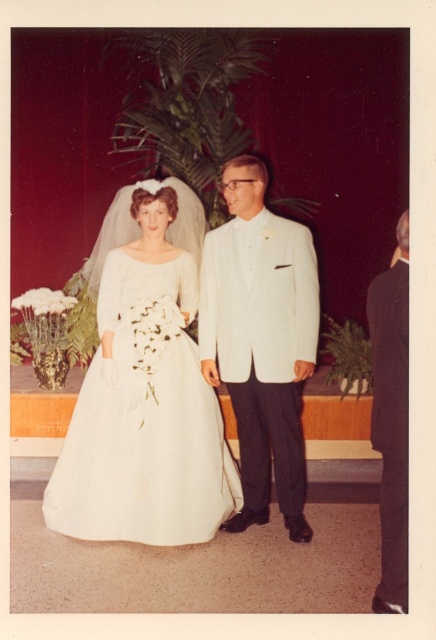
Is white satin dress at center shorter than black satin suit at right?

Incorrect, white satin dress at center's height does not fall short of black satin suit at right's.

Is point (139, 188) more distant than point (381, 348)?

Yes, it is behind point (381, 348).

Does point (205, 419) lie in front of point (391, 342)?

No, (205, 419) is behind (391, 342).

What are the coordinates of `white satin dress at center` in the screenshot? It's located at (146, 394).

Can you confirm if white satin dress at center is positioned to the left of white textured suit at center?

Correct, you'll find white satin dress at center to the left of white textured suit at center.

Does white satin dress at center appear on the right side of white textured suit at center?

No, white satin dress at center is not to the right of white textured suit at center.

Does point (115, 465) come farther from viewer compared to point (242, 237)?

No, (115, 465) is in front of (242, 237).

You are a GUI agent. You are given a task and a screenshot of the screen. Output one action in this format:
    pyautogui.click(x=<x>, y=<y>)
    Task: Click on the white satin dress at center
    This screenshot has height=640, width=436.
    Given the screenshot: What is the action you would take?
    pyautogui.click(x=146, y=394)

Is white textured suit at center positioned behind black satin suit at right?

Yes.

Does white textured suit at center have a greater width compared to black satin suit at right?

Yes.

The image size is (436, 640). Find the location of `white textured suit at center`. white textured suit at center is located at coordinates (261, 339).